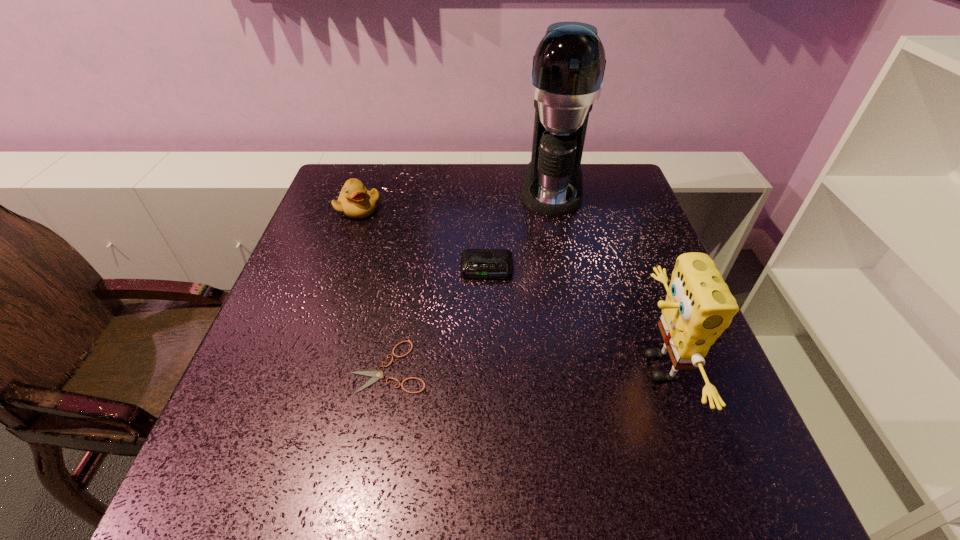
In order to click on vacant area located on the face of the fourth shortest object in this screenshot , I will do `click(576, 367)`.

The width and height of the screenshot is (960, 540). What are the coordinates of `vacant region located on the face of the fourth shortest object` in the screenshot? It's located at (581, 367).

Identify the location of vacant region located on the display of the third object from left to right. The image size is (960, 540). (483, 404).

Where is `vacant space positioned on the display of the third object from left to right`? vacant space positioned on the display of the third object from left to right is located at coordinates (485, 342).

This screenshot has height=540, width=960. What are the coordinates of `free space located 0.380m on the display of the third object from left to right` in the screenshot? It's located at (x=482, y=436).

The image size is (960, 540). What are the coordinates of `vacant space located 0.110m on the front-facing side of the third shortest object` in the screenshot? It's located at (392, 238).

Where is `vacant space located 0.070m on the front-facing side of the third shortest object`? The image size is (960, 540). vacant space located 0.070m on the front-facing side of the third shortest object is located at coordinates (383, 231).

Find the location of `vacant region located on the front-facing side of the third shortest object`. vacant region located on the front-facing side of the third shortest object is located at coordinates (394, 240).

At what (x,y) coordinates should I click in order to perform the action: click on vacant space positioned place cup under the spout of the coffee maker. Please return your answer as a coordinate pair (x, y). The width and height of the screenshot is (960, 540). Looking at the image, I should click on (546, 297).

At what (x,y) coordinates should I click in order to perform the action: click on free region located place cup under the spout of the coffee maker. Please return your answer as a coordinate pair (x, y). The width and height of the screenshot is (960, 540). Looking at the image, I should click on (547, 285).